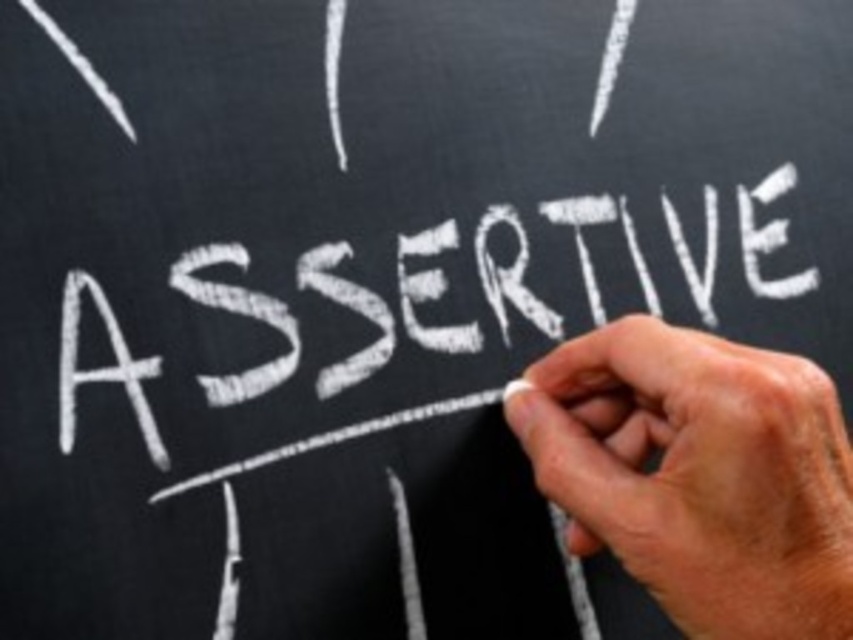
Which is below, dry chalk at center or white chalk writing at center?

dry chalk at center

Does point (633, 557) come behind point (711, 225)?

That is False.

What do you see at coordinates (698, 474) in the screenshot? I see `dry chalk at center` at bounding box center [698, 474].

In order to click on dry chalk at center in this screenshot , I will do `click(698, 474)`.